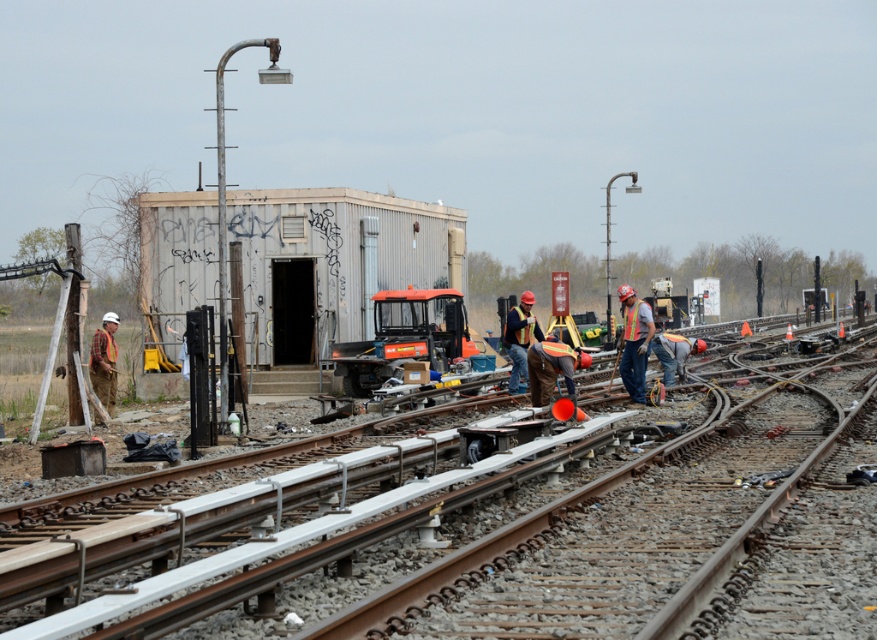
Measure the distance between point (430,332) and camera.

They are 24.33 meters apart.

Does orange plastic tractor at center have a lesser height compared to reflective orange safety vest at center?

Incorrect, orange plastic tractor at center's height does not fall short of reflective orange safety vest at center's.

Which is behind, point (460, 308) or point (631, 305)?

Point (460, 308)

What are the coordinates of `orange plastic tractor at center` in the screenshot? It's located at (404, 337).